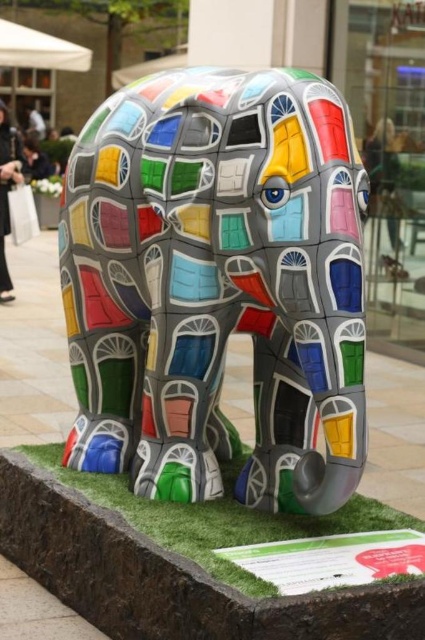
Question: Where is multicolored mosaic elephant at center located in relation to green artificial turf at lower center in the image?

Choices:
 (A) below
 (B) above

Answer: (B)

Question: Which point is closer to the camera taking this photo?

Choices:
 (A) (319, 492)
 (B) (231, 564)

Answer: (B)

Question: Which object appears closest to the camera in this image?

Choices:
 (A) green artificial turf at lower center
 (B) multicolored mosaic elephant at center

Answer: (A)

Question: Does multicolored mosaic elephant at center have a lesser width compared to green artificial turf at lower center?

Choices:
 (A) yes
 (B) no

Answer: (A)

Question: Is the position of multicolored mosaic elephant at center less distant than that of green artificial turf at lower center?

Choices:
 (A) no
 (B) yes

Answer: (A)